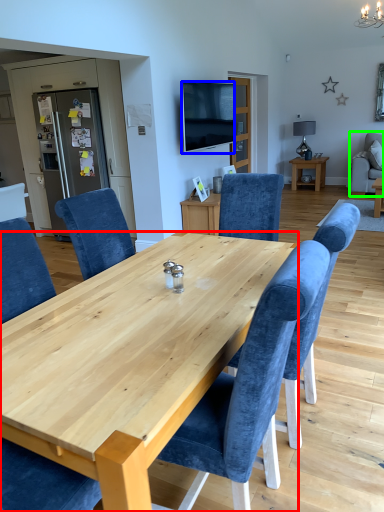
Question: Which object is positioned closest to desk (highlighted by a red box)? Select from television (highlighted by a blue box) and chair (highlighted by a green box).

Choices:
 (A) television
 (B) chair

Answer: (A)